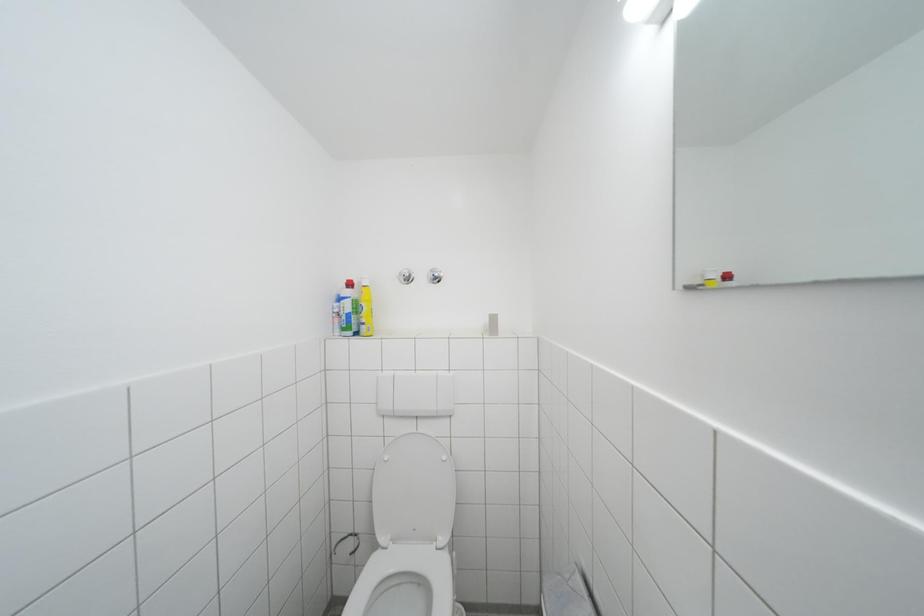
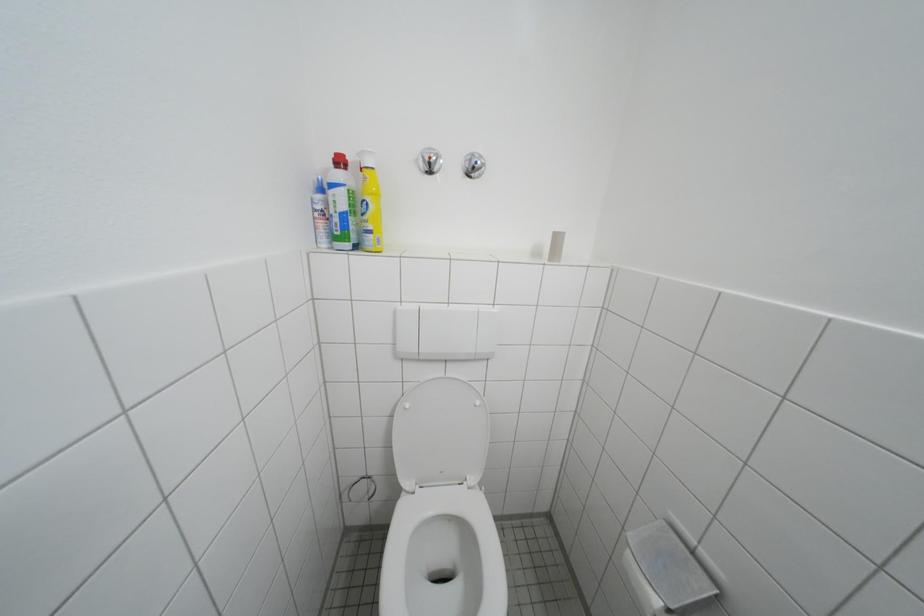
Which direction would the cameraman need to move to produce the second image?

The movement direction of the cameraman is left, forward.